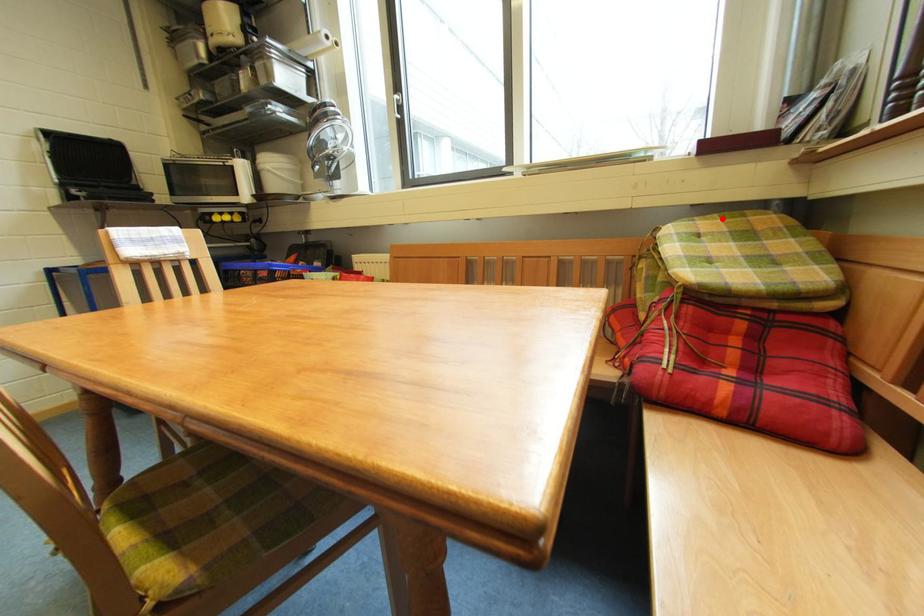
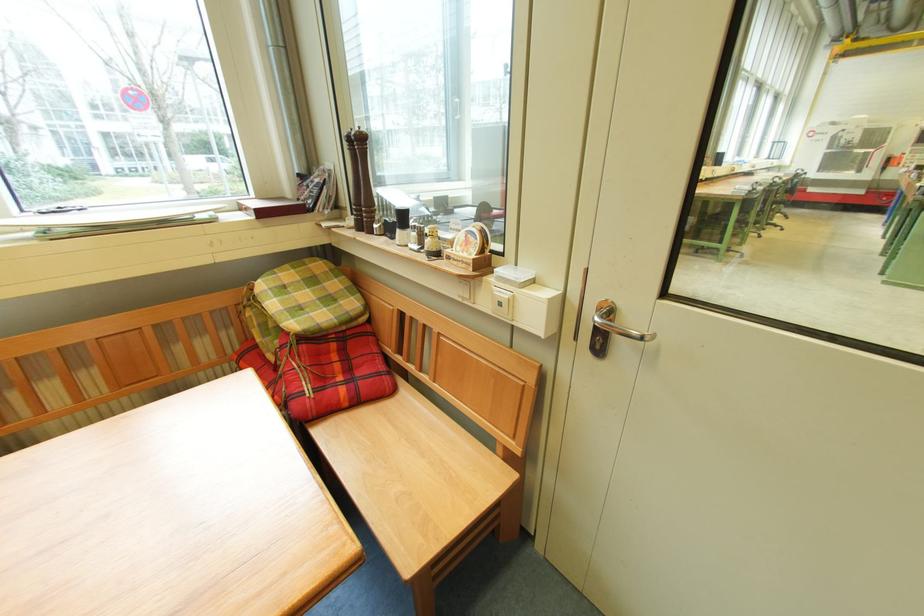
Locate, in the second image, the point that corresponds to the highlighted location in the first image.

(295, 268)